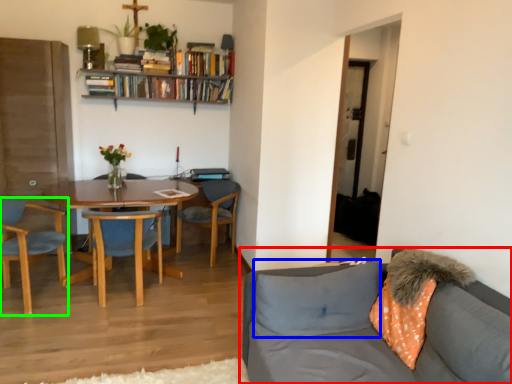
Question: Which object is positioned closest to studio couch (highlighted by a red box)? Select from pillow (highlighted by a blue box) and chair (highlighted by a green box).

Choices:
 (A) pillow
 (B) chair

Answer: (A)